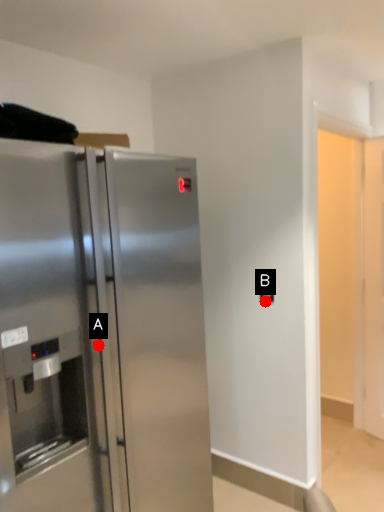
Question: Two points are circled on the image, labeled by A and B beside each circle. Which point is farther from the camera taking this photo?

Choices:
 (A) A is further
 (B) B is further

Answer: (B)